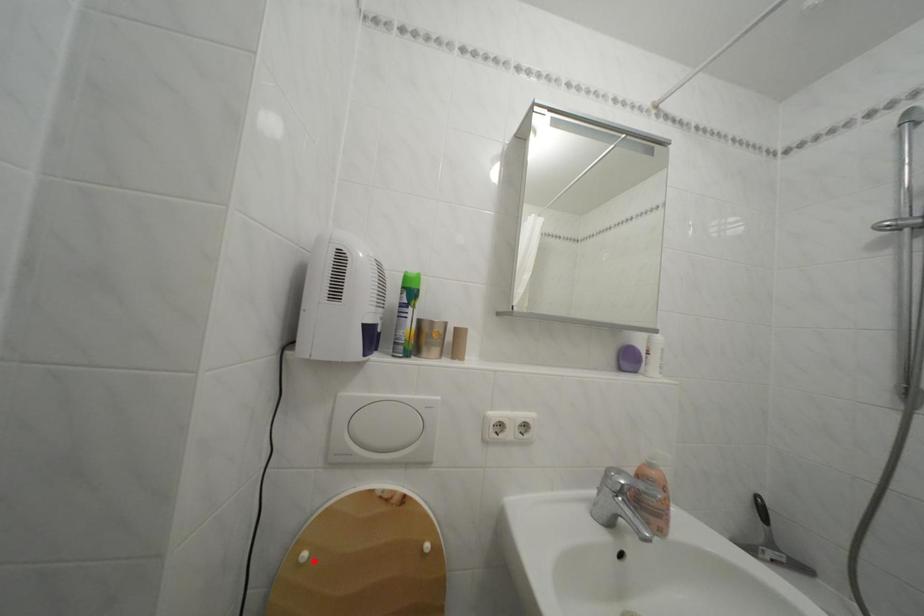
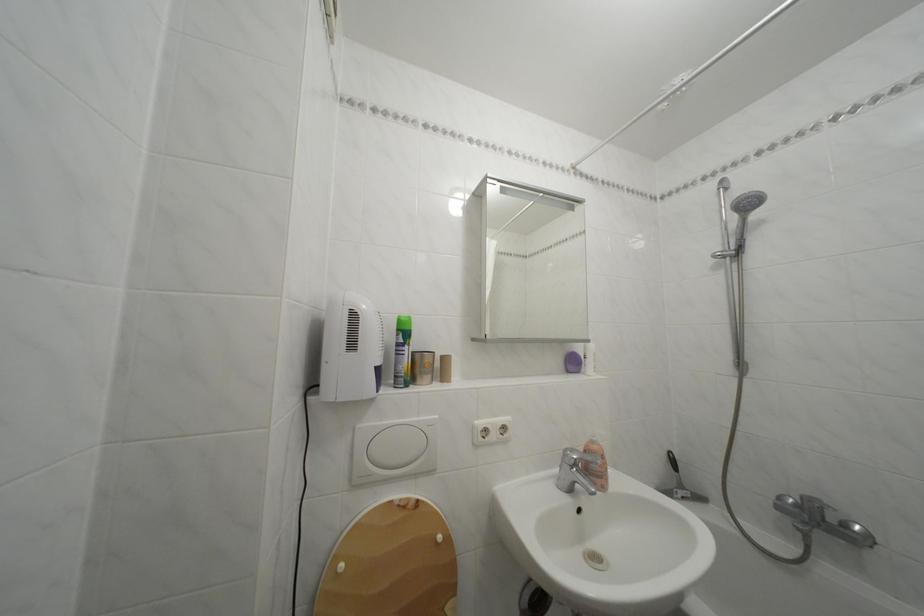
In the second image, find the point that corresponds to the highlighted location in the first image.

(350, 573)